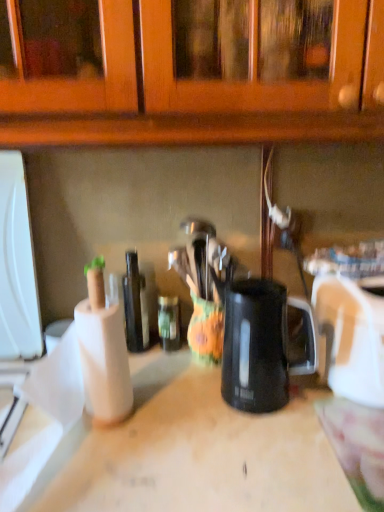
What do you see at coordinates (135, 305) in the screenshot?
I see `shiny dark glass bottle at center, which is the first bottle from left to right` at bounding box center [135, 305].

What is the approximate height of black plastic mug at center?

black plastic mug at center is 26.37 centimeters tall.

In order to click on shiny dark glass bottle at center, positioned as the second bottle in right-to-left order in this screenshot , I will do `click(135, 305)`.

Is green glass bottle at center, which is the 2th bottle in left-to-right order, at the left side of black plastic mug at center?

Correct, you'll find green glass bottle at center, which is the 2th bottle in left-to-right order, to the left of black plastic mug at center.

Are green glass bottle at center, which is the 2th bottle in left-to-right order, and black plastic mug at center beside each other?

There is a gap between green glass bottle at center, which is the 2th bottle in left-to-right order, and black plastic mug at center.

Is point (170, 310) closer to viewer compared to point (252, 381)?

No, (170, 310) is further to viewer.

From the picture: Is green glass bottle at center, the 1th bottle positioned from the right, aimed at black plastic mug at center?

No, green glass bottle at center, the 1th bottle positioned from the right, is not facing towards black plastic mug at center.

Is green glass bottle at center, the 1th bottle positioned from the right, to the right of wooden at center from the viewer's perspective?

No, green glass bottle at center, the 1th bottle positioned from the right, is not to the right of wooden at center.

Which is in front, green glass bottle at center, the 1th bottle positioned from the right, or wooden at center?

wooden at center.

Is green glass bottle at center, which is the 2th bottle in left-to-right order, wider or thinner than wooden at center?

Clearly, green glass bottle at center, which is the 2th bottle in left-to-right order, has less width compared to wooden at center.

From a real-world perspective, is green glass bottle at center, the 1th bottle positioned from the right, below wooden at center?

No.

This screenshot has width=384, height=512. What are the coordinates of `mug on the left of the wooden at center` in the screenshot? It's located at (259, 345).

Between black plastic mug at center and wooden at center, which one has larger size?

Bigger between the two is wooden at center.

Does black plastic mug at center have a lesser width compared to wooden at center?

Indeed, black plastic mug at center has a lesser width compared to wooden at center.

Are black plastic mug at center and wooden at center making contact?

They are not placed beside each other.

Who is bigger, shiny dark glass bottle at center, which is the first bottle from left to right, or black plastic mug at center?

With larger size is black plastic mug at center.

In the image, is shiny dark glass bottle at center, which is the first bottle from left to right, positioned in front of or behind black plastic mug at center?

Clearly, shiny dark glass bottle at center, which is the first bottle from left to right, is behind black plastic mug at center.

The image size is (384, 512). I want to click on mug that is on the right side of shiny dark glass bottle at center, which is the first bottle from left to right, so click(x=259, y=345).

From the image's perspective, which is below, shiny dark glass bottle at center, which is the first bottle from left to right, or white plastic toaster at right?

white plastic toaster at right.

Is point (144, 335) positioned before point (373, 337)?

No, it is not.

Is shiny dark glass bottle at center, positioned as the second bottle in right-to-left order, surrounding white plastic toaster at right?

No, white plastic toaster at right is not inside shiny dark glass bottle at center, positioned as the second bottle in right-to-left order.

How different are the orientations of shiny dark glass bottle at center, which is the first bottle from left to right, and white plastic toaster at right in degrees?

The facing directions of shiny dark glass bottle at center, which is the first bottle from left to right, and white plastic toaster at right are 4.86 degrees apart.

Based on the photo, between wooden at center and green glass bottle at center, the 1th bottle positioned from the right, which one appears on the left side from the viewer's perspective?

From the viewer's perspective, green glass bottle at center, the 1th bottle positioned from the right, appears more on the left side.

How many degrees apart are the facing directions of wooden at center and green glass bottle at center, the 1th bottle positioned from the right?

0.678 degrees separate the facing orientations of wooden at center and green glass bottle at center, the 1th bottle positioned from the right.

How far apart are wooden at center and green glass bottle at center, which is the 2th bottle in left-to-right order?

wooden at center is 13.27 inches from green glass bottle at center, which is the 2th bottle in left-to-right order.

Is the position of wooden at center more distant than that of green glass bottle at center, which is the 2th bottle in left-to-right order?

No.

From the image's perspective, relative to shiny dark glass bottle at center, which is the first bottle from left to right, is white plastic toaster at right above or below?

Based on their image positions, white plastic toaster at right is located beneath shiny dark glass bottle at center, which is the first bottle from left to right.

Which is less distant, (360, 371) or (123, 297)?

Point (360, 371)

Is the surface of white plastic toaster at right in direct contact with shiny dark glass bottle at center, positioned as the second bottle in right-to-left order?

No, white plastic toaster at right is not beside shiny dark glass bottle at center, positioned as the second bottle in right-to-left order.

Is shiny dark glass bottle at center, which is the first bottle from left to right, at the back of white plastic toaster at right?

That's not correct — white plastic toaster at right is not looking away from shiny dark glass bottle at center, which is the first bottle from left to right.

Starting from the black plastic mug at center, which bottle is the 1st one to the left? Please provide its 2D coordinates.

[(169, 322)]

Identify the location of counter top in front of the green glass bottle at center, the 1th bottle positioned from the right. This screenshot has width=384, height=512. (177, 452).

Based on their spatial positions, is white plastic toaster at right or wooden at center closer to shiny dark glass bottle at center, which is the first bottle from left to right?

Based on the image, wooden at center appears to be nearer to shiny dark glass bottle at center, which is the first bottle from left to right.

Looking at the image, which one is located closer to white plastic toaster at right, black plastic mug at center or wooden at center?

Among the two, black plastic mug at center is located nearer to white plastic toaster at right.

Looking at the image, which one is located further to black plastic mug at center, green glass bottle at center, the 1th bottle positioned from the right, or white plastic toaster at right?

green glass bottle at center, the 1th bottle positioned from the right.

When comparing their distances from wooden at center, does shiny dark glass bottle at center, positioned as the second bottle in right-to-left order, or green glass bottle at center, the 1th bottle positioned from the right, seem closer?

shiny dark glass bottle at center, positioned as the second bottle in right-to-left order, lies closer to wooden at center than the other object.

Estimate the real-world distances between objects in this image. Which object is closer to black plastic mug at center, wooden at center or white plastic toaster at right?

Answer: white plastic toaster at right is closer to black plastic mug at center.

Which object lies further to the anchor point shiny dark glass bottle at center, positioned as the second bottle in right-to-left order, wooden at center or green glass bottle at center, the 1th bottle positioned from the right?

wooden at center is further to shiny dark glass bottle at center, positioned as the second bottle in right-to-left order.

Based on their spatial positions, is black plastic mug at center or white plastic toaster at right closer to shiny dark glass bottle at center, which is the first bottle from left to right?

black plastic mug at center.

Considering their positions, is white plastic toaster at right positioned closer to black plastic mug at center than green glass bottle at center, the 1th bottle positioned from the right?

The object closer to black plastic mug at center is white plastic toaster at right.

This screenshot has height=512, width=384. I want to click on appliance between shiny dark glass bottle at center, which is the first bottle from left to right, and wooden at center in the up-down direction, so click(352, 336).

Where is `mug between shiny dark glass bottle at center, which is the first bottle from left to right, and wooden at center, in the vertical direction`? This screenshot has height=512, width=384. mug between shiny dark glass bottle at center, which is the first bottle from left to right, and wooden at center, in the vertical direction is located at coordinates pos(259,345).

Where is `mug between green glass bottle at center, which is the 2th bottle in left-to-right order, and wooden at center, in the vertical direction`? The height and width of the screenshot is (512, 384). mug between green glass bottle at center, which is the 2th bottle in left-to-right order, and wooden at center, in the vertical direction is located at coordinates (259, 345).

This screenshot has width=384, height=512. Find the location of `bottle located between shiny dark glass bottle at center, which is the first bottle from left to right, and black plastic mug at center in the left-right direction`. bottle located between shiny dark glass bottle at center, which is the first bottle from left to right, and black plastic mug at center in the left-right direction is located at coordinates (169, 322).